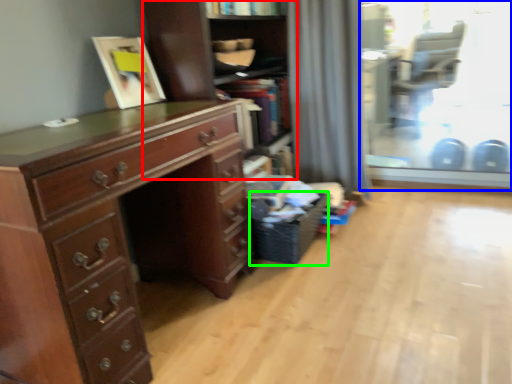
Question: Which object is positioned farthest from shelf (highlighted by a red box)? Select from glass door (highlighted by a blue box) and laundry basket (highlighted by a green box).

Choices:
 (A) glass door
 (B) laundry basket

Answer: (A)